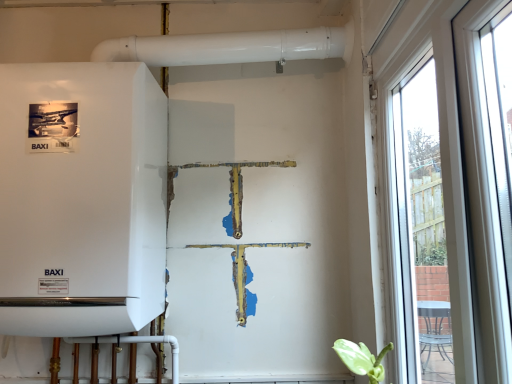
Question: Looking at their shapes, would you say transparent glass window at right is wider or thinner than white matte boiler at left?

Choices:
 (A) thin
 (B) wide

Answer: (A)

Question: Considering the positions of transparent glass window at right and white matte boiler at left in the image, is transparent glass window at right bigger or smaller than white matte boiler at left?

Choices:
 (A) big
 (B) small

Answer: (B)

Question: Is transparent glass window at right in front of or behind white matte boiler at left in the image?

Choices:
 (A) front
 (B) behind

Answer: (A)

Question: From their relative heights in the image, would you say white matte boiler at left is taller or shorter than transparent glass window at right?

Choices:
 (A) short
 (B) tall

Answer: (A)

Question: From the image's perspective, is white matte boiler at left positioned above or below transparent glass window at right?

Choices:
 (A) above
 (B) below

Answer: (A)

Question: Based on their sizes in the image, would you say white matte boiler at left is bigger or smaller than transparent glass window at right?

Choices:
 (A) big
 (B) small

Answer: (A)

Question: Is white matte boiler at left situated inside transparent glass window at right or outside?

Choices:
 (A) inside
 (B) outside

Answer: (B)